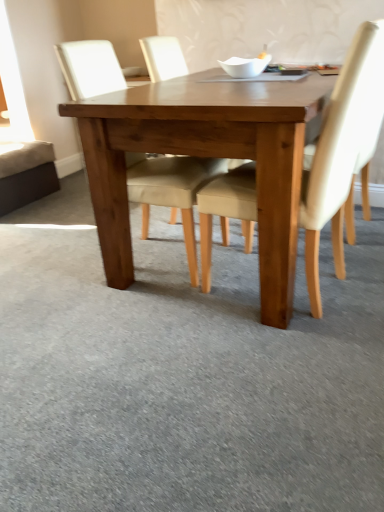
Question: From the image's perspective, is light brown wooden table at center on beige fabric chair at center, the second chair positioned from the right?

Choices:
 (A) no
 (B) yes

Answer: (B)

Question: Is beige fabric chair at center, the second chair positioned from the right, surrounded by light brown wooden table at center?

Choices:
 (A) no
 (B) yes

Answer: (B)

Question: Can you confirm if light brown wooden table at center is thinner than beige fabric chair at center, which is the first chair in left-to-right order?

Choices:
 (A) no
 (B) yes

Answer: (A)

Question: Considering the relative sizes of light brown wooden table at center and beige fabric chair at center, which is the first chair in left-to-right order, in the image provided, is light brown wooden table at center bigger than beige fabric chair at center, which is the first chair in left-to-right order,?

Choices:
 (A) no
 (B) yes

Answer: (B)

Question: Considering the relative positions of light brown wooden table at center and beige fabric chair at center, the second chair positioned from the right, in the image provided, is light brown wooden table at center to the right of beige fabric chair at center, the second chair positioned from the right, from the viewer's perspective?

Choices:
 (A) no
 (B) yes

Answer: (B)

Question: Looking at their shapes, would you say light brown wooden table at center is wider or thinner than light beige fabric chair at center, positioned as the 2th chair in left-to-right order?

Choices:
 (A) wide
 (B) thin

Answer: (A)

Question: In the image, is light brown wooden table at center positioned in front of or behind light beige fabric chair at center, positioned as the 2th chair in left-to-right order?

Choices:
 (A) front
 (B) behind

Answer: (B)

Question: Considering the positions of point (274, 228) and point (334, 143), is point (274, 228) closer or farther from the camera than point (334, 143)?

Choices:
 (A) farther
 (B) closer

Answer: (A)

Question: Would you say light brown wooden table at center is inside or outside light beige fabric chair at center, positioned as the 2th chair in left-to-right order?

Choices:
 (A) outside
 (B) inside

Answer: (A)

Question: Considering the positions of point tap(370, 65) and point tap(120, 138), is point tap(370, 65) closer or farther from the camera than point tap(120, 138)?

Choices:
 (A) farther
 (B) closer

Answer: (B)

Question: Is light beige fabric chair at center, the first chair when ordered from right to left, to the left or to the right of light brown wooden table at center in the image?

Choices:
 (A) right
 (B) left

Answer: (A)

Question: Relative to light brown wooden table at center, is light beige fabric chair at center, positioned as the 2th chair in left-to-right order, in front or behind?

Choices:
 (A) front
 (B) behind

Answer: (A)

Question: Considering the positions of light beige fabric chair at center, the first chair when ordered from right to left, and light brown wooden table at center in the image, is light beige fabric chair at center, the first chair when ordered from right to left, taller or shorter than light brown wooden table at center?

Choices:
 (A) short
 (B) tall

Answer: (B)

Question: Is light beige fabric chair at center, positioned as the 2th chair in left-to-right order, bigger or smaller than beige fabric chair at center, which is the first chair in left-to-right order?

Choices:
 (A) big
 (B) small

Answer: (B)

Question: From the image's perspective, relative to beige fabric chair at center, which is the first chair in left-to-right order, is light beige fabric chair at center, positioned as the 2th chair in left-to-right order, above or below?

Choices:
 (A) above
 (B) below

Answer: (B)